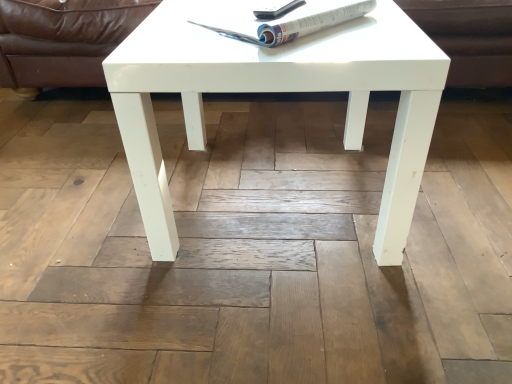
Locate an element on the screen. This screenshot has height=384, width=512. vacant space in front of white glossy magazine at upper center is located at coordinates (294, 48).